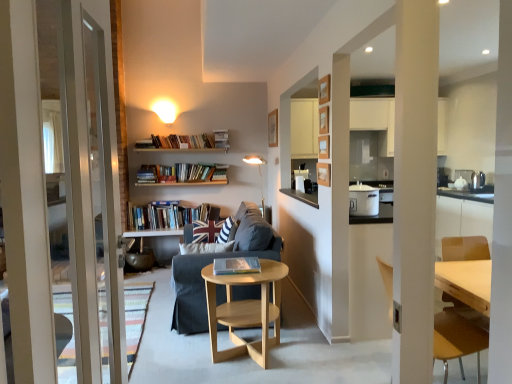
Question: Is dark gray fabric couch at center facing away from striped fabric pillow at center?

Choices:
 (A) no
 (B) yes

Answer: (B)

Question: From a real-world perspective, is dark gray fabric couch at center positioned over striped fabric pillow at center based on gravity?

Choices:
 (A) no
 (B) yes

Answer: (A)

Question: Does dark gray fabric couch at center have a larger size compared to striped fabric pillow at center?

Choices:
 (A) yes
 (B) no

Answer: (A)

Question: Is dark gray fabric couch at center positioned behind striped fabric pillow at center?

Choices:
 (A) no
 (B) yes

Answer: (A)

Question: Considering the relative sizes of dark gray fabric couch at center and striped fabric pillow at center in the image provided, is dark gray fabric couch at center shorter than striped fabric pillow at center?

Choices:
 (A) no
 (B) yes

Answer: (A)

Question: Considering their positions, is metallic silver kettle at right, the second appliance in the left-to-right sequence, located in front of or behind striped fabric pillow at center?

Choices:
 (A) front
 (B) behind

Answer: (B)

Question: From the image's perspective, is metallic silver kettle at right, the second appliance in the left-to-right sequence, located above or below striped fabric pillow at center?

Choices:
 (A) above
 (B) below

Answer: (A)

Question: Is metallic silver kettle at right, the second appliance in the left-to-right sequence, taller or shorter than striped fabric pillow at center?

Choices:
 (A) short
 (B) tall

Answer: (A)

Question: From a real-world perspective, is metallic silver kettle at right, arranged as the 2th appliance when viewed from the front, positioned above or below striped fabric pillow at center?

Choices:
 (A) below
 (B) above

Answer: (B)

Question: Is hardcover book at center, which is the second book in left-to-right order, to the left or to the right of gold metallic floor lamp at center in the image?

Choices:
 (A) right
 (B) left

Answer: (B)

Question: Is hardcover book at center, which appears as the first book when viewed from the right, situated inside gold metallic floor lamp at center or outside?

Choices:
 (A) inside
 (B) outside

Answer: (B)

Question: In terms of width, does hardcover book at center, which is the second book in left-to-right order, look wider or thinner when compared to gold metallic floor lamp at center?

Choices:
 (A) thin
 (B) wide

Answer: (B)

Question: In terms of size, does hardcover book at center, which ranks as the first book in bottom-to-top order, appear bigger or smaller than gold metallic floor lamp at center?

Choices:
 (A) small
 (B) big

Answer: (A)

Question: From a real-world perspective, is light brown wooden chair at right positioned above or below hardcover books at center, placed as the 2th book when sorted from bottom to top?

Choices:
 (A) above
 (B) below

Answer: (B)

Question: Does point (478, 327) appear closer or farther from the camera than point (194, 208)?

Choices:
 (A) closer
 (B) farther

Answer: (A)